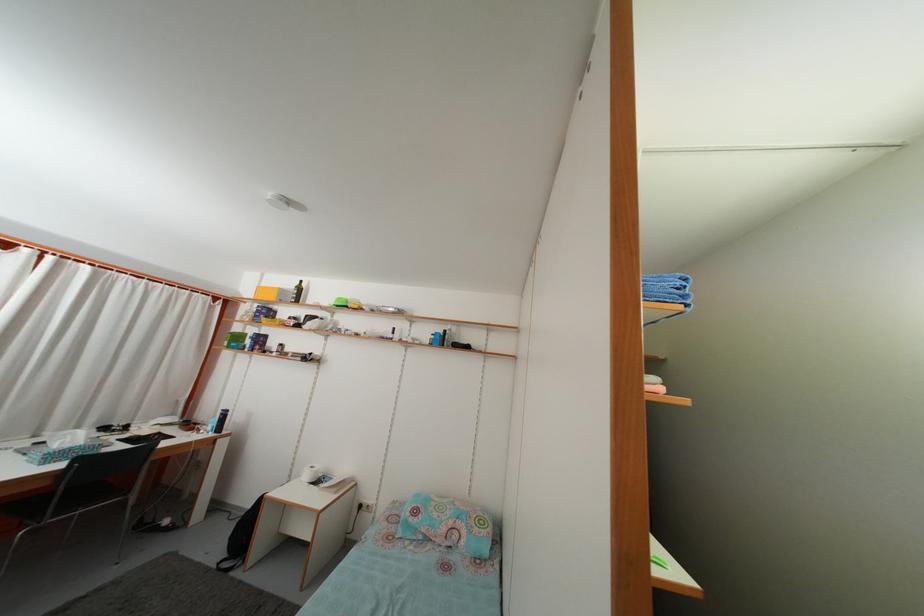
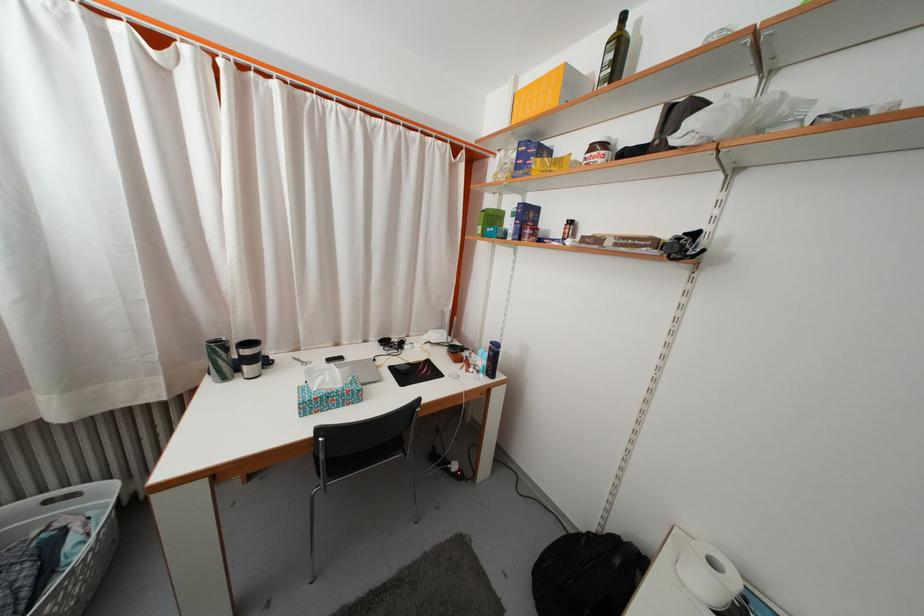
Find the pixel in the second image that matches (261,323) in the first image.

(523, 175)